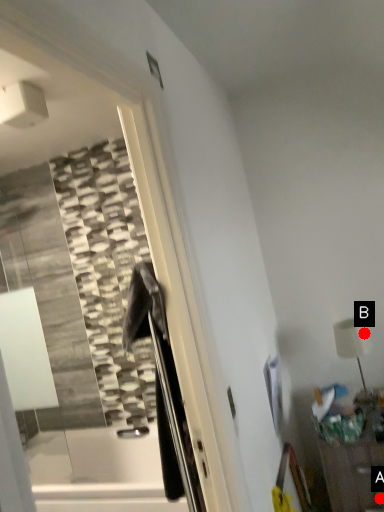
Question: Two points are circled on the image, labeled by A and B beside each circle. Which of the following is the closest to the observer?

Choices:
 (A) A is closer
 (B) B is closer

Answer: (A)